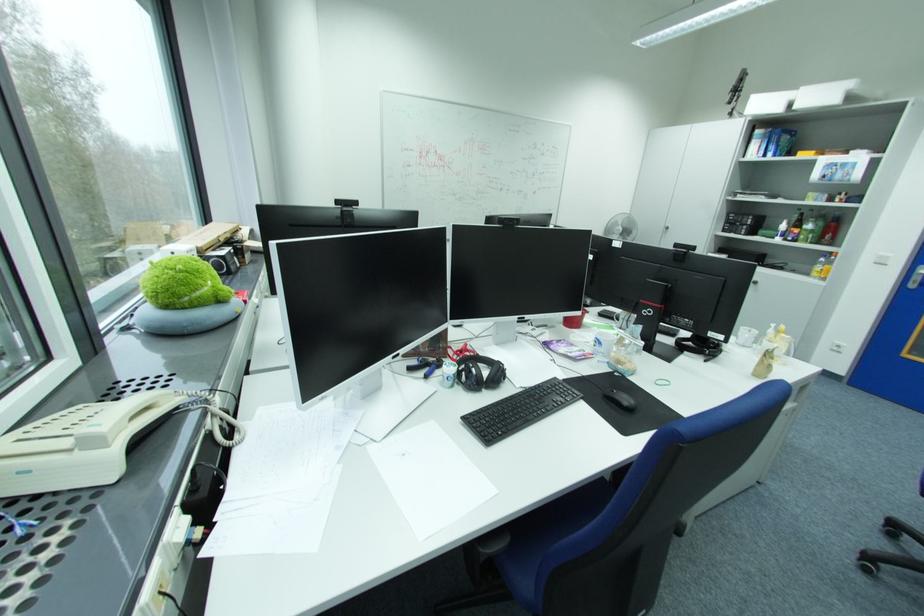
What do you see at coordinates (823, 265) in the screenshot?
I see `a bottle pump dispenser` at bounding box center [823, 265].